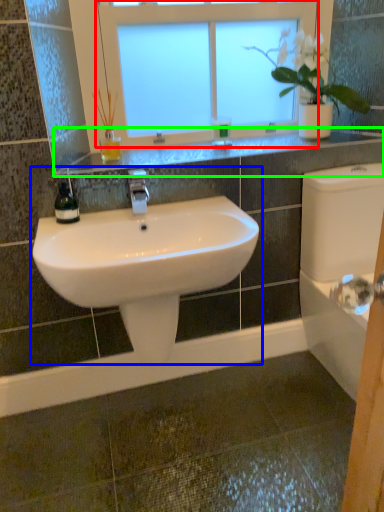
Question: Considering the real-world distances, which object is farthest from window (highlighted by a red box)? sink (highlighted by a blue box) or window sill (highlighted by a green box)?

Choices:
 (A) sink
 (B) window sill

Answer: (A)